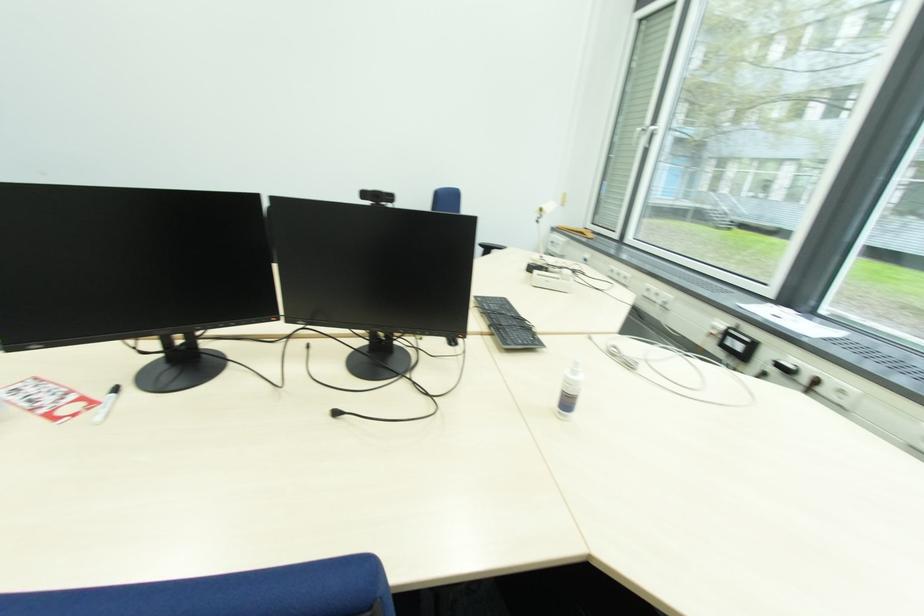
This screenshot has width=924, height=616. Identify the location of white marker. (106, 403).